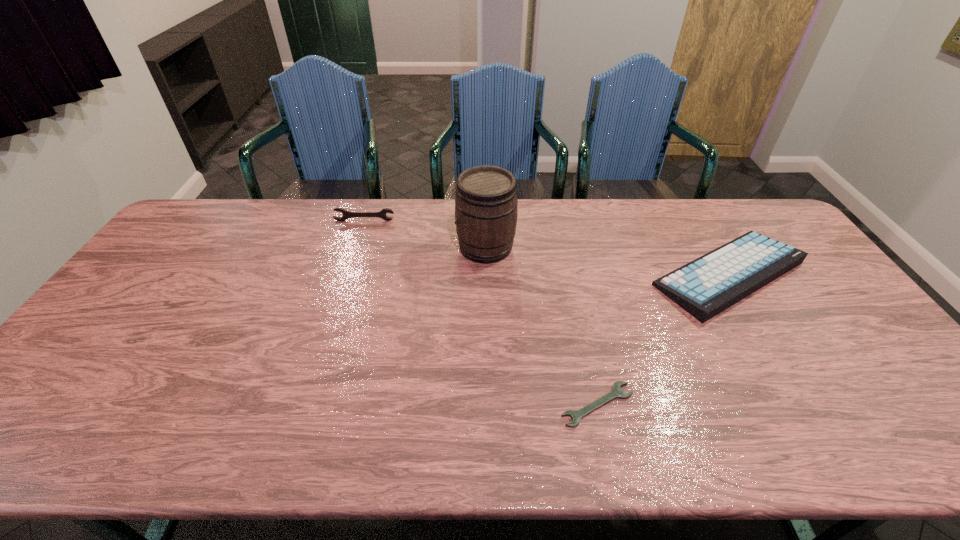
In order to click on vacant area situated 0.380m on the right of the third object from left to right in this screenshot , I will do `click(800, 404)`.

Identify the location of wine bucket at the far edge. (486, 210).

What are the coordinates of `wrench located in the far edge section of the desktop` in the screenshot? It's located at (346, 214).

Where is `computer keyboard located at the far edge`? This screenshot has height=540, width=960. computer keyboard located at the far edge is located at coordinates (710, 284).

Locate an element on the screen. This screenshot has width=960, height=540. object present at the near edge is located at coordinates (576, 415).

Locate an element on the screen. object located at the right edge is located at coordinates (710, 284).

Identify the location of object positioned at the far right corner. The height and width of the screenshot is (540, 960). (710, 284).

The height and width of the screenshot is (540, 960). Find the location of `vacant region at the far edge of the desktop`. vacant region at the far edge of the desktop is located at coordinates (581, 234).

The height and width of the screenshot is (540, 960). In order to click on vacant space at the near edge in this screenshot , I will do `click(504, 434)`.

Where is `vacant space at the left edge of the desktop`? vacant space at the left edge of the desktop is located at coordinates (135, 333).